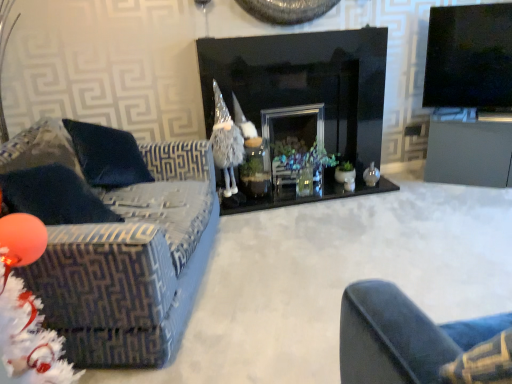
Where is `free space above matte gray table at right (from a real-world perspective)`? free space above matte gray table at right (from a real-world perspective) is located at coordinates (466, 116).